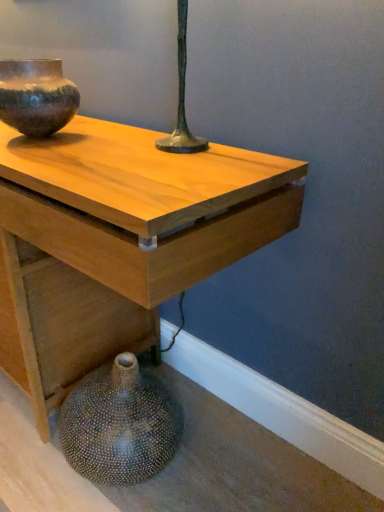
This screenshot has width=384, height=512. I want to click on free point to the right of speckled ceramic vase at lower left, which is the 2th vase from top to bottom, so click(219, 457).